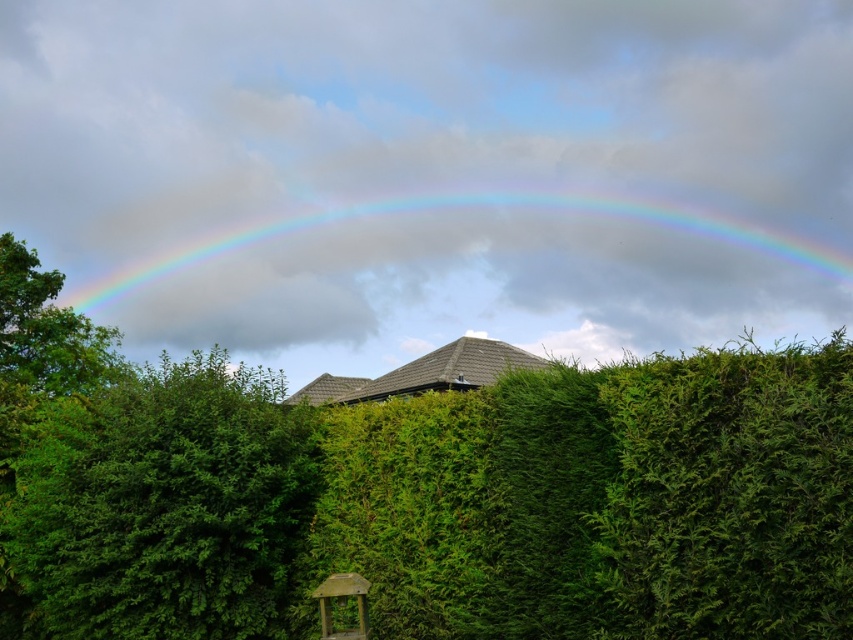
Question: From the image, what is the correct spatial relationship of glossy rainbow at upper center in relation to wooden gazebo at lower center?

Choices:
 (A) above
 (B) below

Answer: (A)

Question: Can you confirm if glossy rainbow at upper center is positioned to the right of wooden gazebo at lower center?

Choices:
 (A) yes
 (B) no

Answer: (A)

Question: Which point appears closest to the camera in this image?

Choices:
 (A) (80, 381)
 (B) (200, 429)
 (C) (329, 637)
 (D) (674, 220)

Answer: (C)

Question: Where is glossy rainbow at upper center located in relation to wooden gazebo at lower center in the image?

Choices:
 (A) left
 (B) right

Answer: (B)

Question: Which object appears closest to the camera in this image?

Choices:
 (A) green leafy bush at left
 (B) wooden gazebo at lower center
 (C) green leafy tree at left

Answer: (B)

Question: Which object is closer to the camera taking this photo?

Choices:
 (A) glossy rainbow at upper center
 (B) green leafy tree at left

Answer: (B)